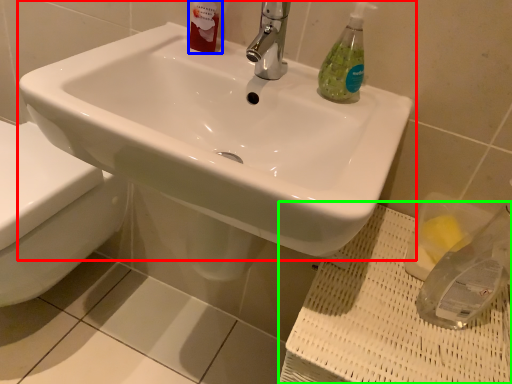
Question: Which object is the closest to the sink (highlighted by a red box)? Choose among these: toiletry (highlighted by a blue box) or porcelain (highlighted by a green box).

Choices:
 (A) toiletry
 (B) porcelain

Answer: (A)